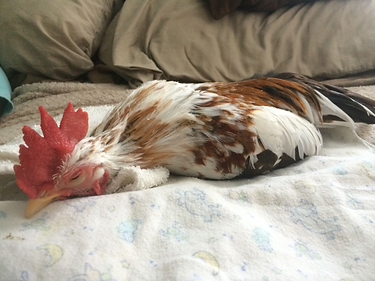
You are a GUI agent. You are given a task and a screenshot of the screen. Output one action in this format:
    pyautogui.click(x=<x>, y=<y>)
    Task: Click on the pillow
    This screenshot has width=375, height=281.
    Given the screenshot: What is the action you would take?
    pyautogui.click(x=264, y=33), pyautogui.click(x=60, y=36)